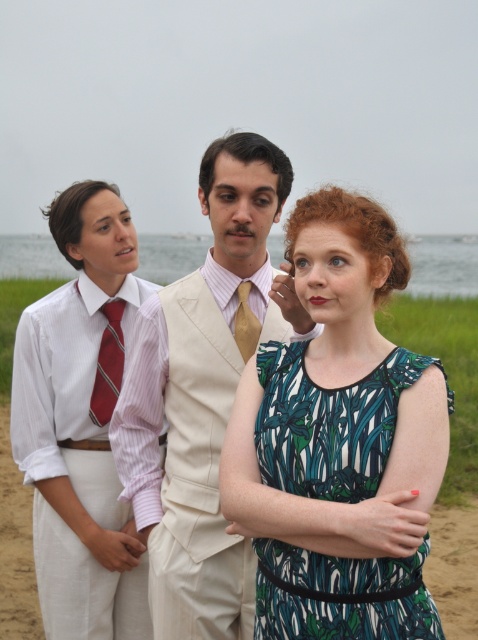
Question: Among these points, which one is farthest from the camera?

Choices:
 (A) (110, 388)
 (B) (297, 452)

Answer: (A)

Question: Can you confirm if light beige vest at center is thinner than matte striped shirt at left?

Choices:
 (A) no
 (B) yes

Answer: (A)

Question: Can you confirm if light beige vest at center is smaller than gold silk tie at center?

Choices:
 (A) yes
 (B) no

Answer: (B)

Question: Which object appears farthest from the camera in this image?

Choices:
 (A) printed fabric dress at center
 (B) striped silk tie at center
 (C) light beige vest at center
 (D) matte striped shirt at left

Answer: (B)

Question: Is light beige vest at center in front of matte striped shirt at left?

Choices:
 (A) yes
 (B) no

Answer: (A)

Question: Which point is farther to the camera?

Choices:
 (A) (280, 157)
 (B) (382, 372)
 (C) (128, 596)
 (D) (115, 388)

Answer: (C)